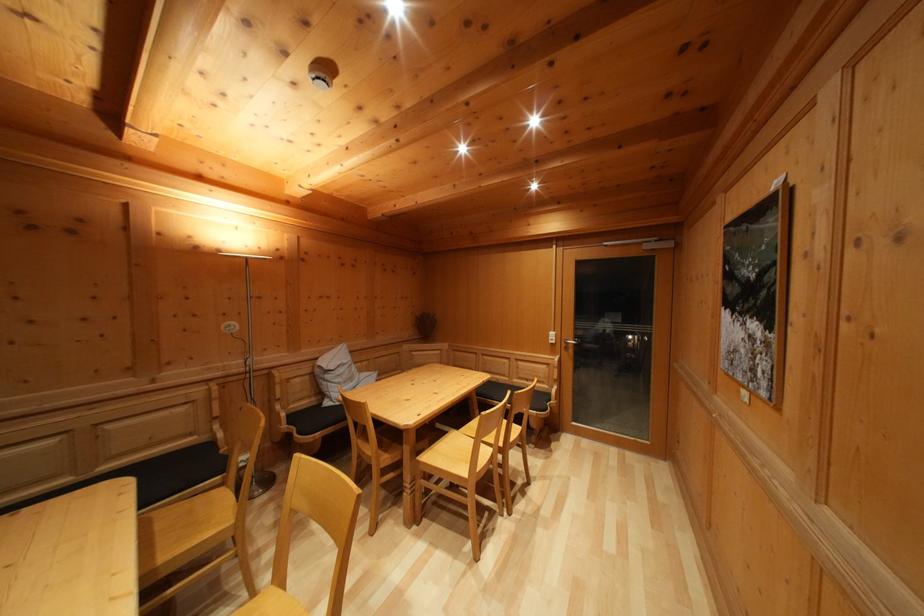
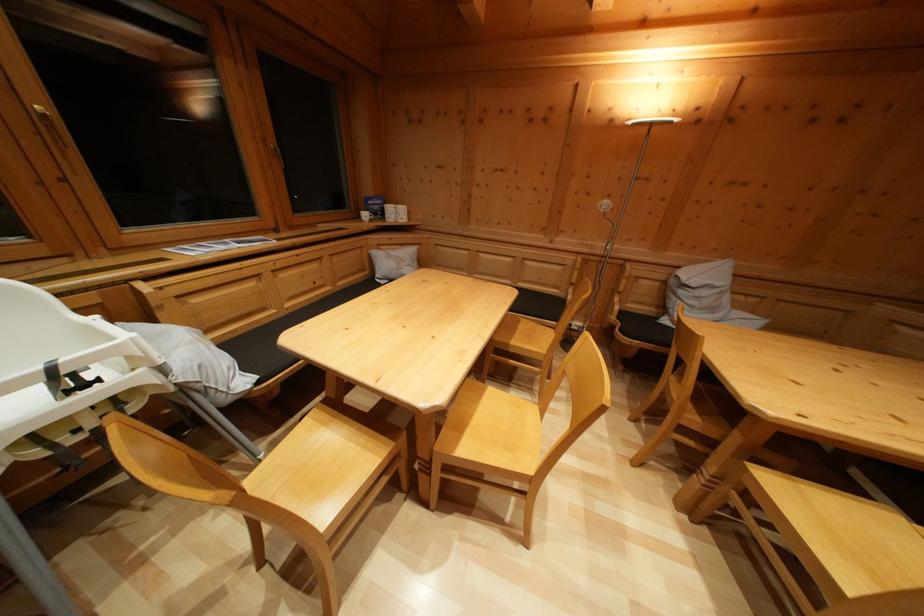
Locate, in the second image, the point that corresponds to (x=294, y=423) in the first image.

(626, 318)